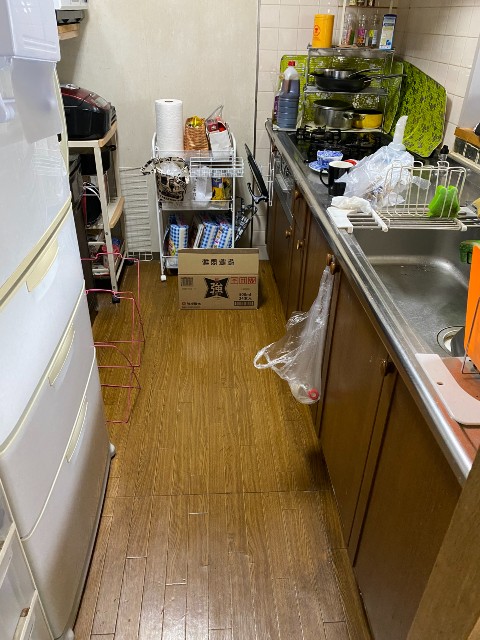
The width and height of the screenshot is (480, 640). In order to click on box in this screenshot , I will do (232, 298).